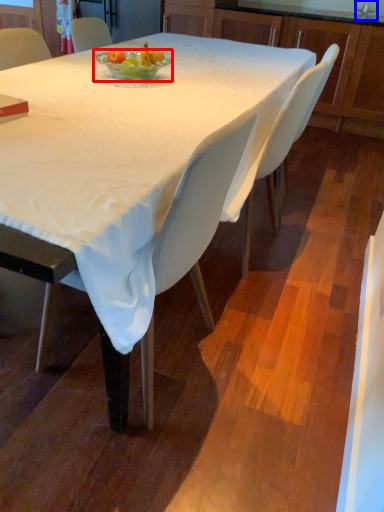
Question: Which object appears closest to the camera in this image, bowl (highlighted by a red box) or faucet (highlighted by a blue box)?

Choices:
 (A) bowl
 (B) faucet

Answer: (A)